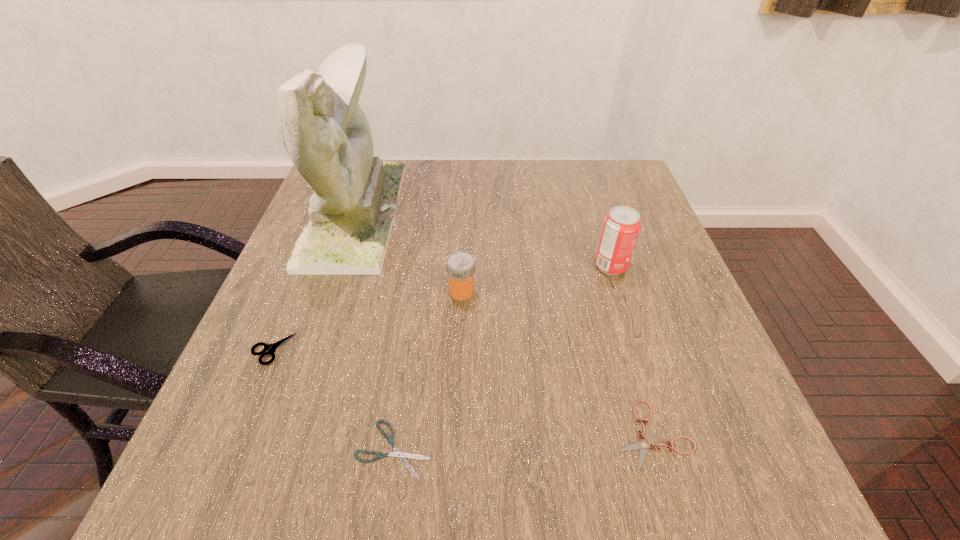
The width and height of the screenshot is (960, 540). Find the location of `vacant area between the third object from left to right and the soda can`. vacant area between the third object from left to right and the soda can is located at coordinates point(502,357).

The width and height of the screenshot is (960, 540). In order to click on vacant point located between the tallest shears and the soda can in this screenshot , I will do `click(442, 308)`.

At what (x,y) coordinates should I click in order to perform the action: click on vacant area that lies between the third object from right to left and the tallest object. Please return your answer as a coordinate pair (x, y). The height and width of the screenshot is (540, 960). Looking at the image, I should click on (x=408, y=253).

You are a GUI agent. You are given a task and a screenshot of the screen. Output one action in this format:
    pyautogui.click(x=<x>, y=<y>)
    Task: Click on the free space between the second shears from right to left and the rightmost shears
    This screenshot has height=540, width=960.
    Given the screenshot: What is the action you would take?
    pyautogui.click(x=522, y=442)

The image size is (960, 540). Find the location of `vacant space in between the sculpture and the soda can`. vacant space in between the sculpture and the soda can is located at coordinates (483, 240).

The image size is (960, 540). Find the location of `empty space that is in between the tallest object and the leftmost shears`. empty space that is in between the tallest object and the leftmost shears is located at coordinates (314, 281).

This screenshot has width=960, height=540. In order to click on free space between the second tallest object and the third object from left to right in this screenshot , I will do `click(502, 357)`.

Select which object appears as the fourth closest to the third object from left to right. Please provide its 2D coordinates. Your answer should be formatted as a tuple, i.e. [(x, y)], where the tuple contains the x and y coordinates of a point satisfying the conditions above.

[(326, 134)]

Where is `the fifth closest object to the fifth shortest object`? The width and height of the screenshot is (960, 540). the fifth closest object to the fifth shortest object is located at coordinates (270, 348).

Find the location of a particular element. The width and height of the screenshot is (960, 540). the closest shears to the fourth object from right to left is located at coordinates (270, 348).